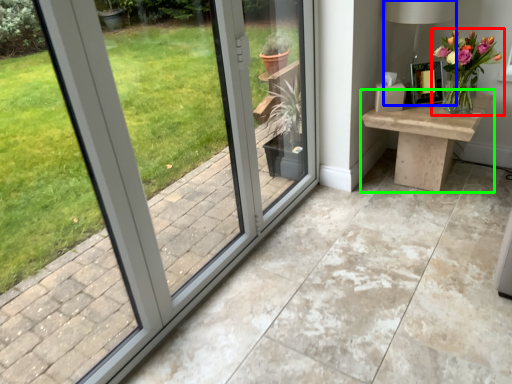
Question: Estimate the real-world distances between objects in this image. Which object is closer to houseplant (highlighted by a red box), table lamp (highlighted by a blue box) or table (highlighted by a green box)?

Choices:
 (A) table lamp
 (B) table

Answer: (B)